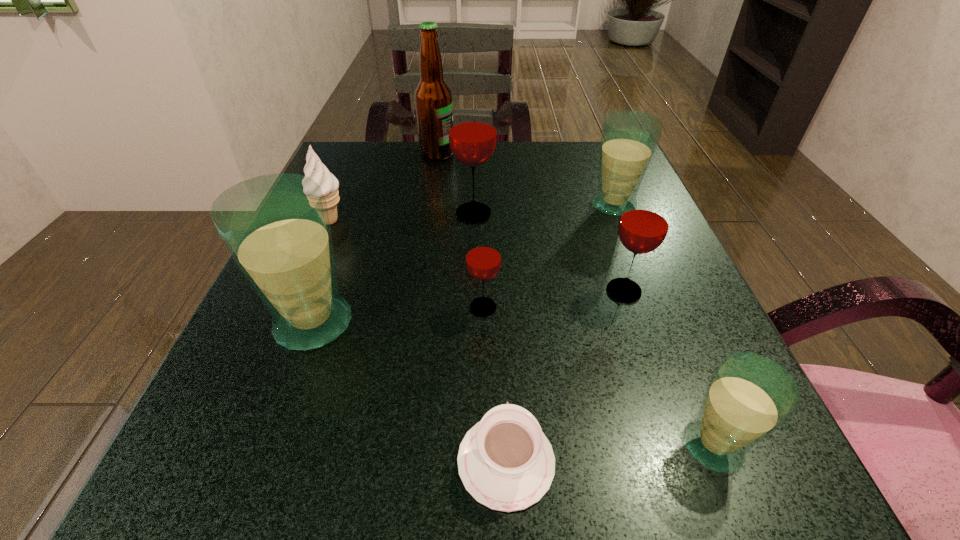
Where is `vacant region located 0.230m on the handle side of the teacup`? Image resolution: width=960 pixels, height=540 pixels. vacant region located 0.230m on the handle side of the teacup is located at coordinates 498,291.

Where is `blank area located 0.150m on the handle side of the teacup`? blank area located 0.150m on the handle side of the teacup is located at coordinates (500, 327).

Identify the location of free point located 0.220m on the handle side of the teacup. The height and width of the screenshot is (540, 960). coord(499,295).

Where is `beer bottle at the far edge`? beer bottle at the far edge is located at coordinates (433, 97).

Image resolution: width=960 pixels, height=540 pixels. I want to click on glass situated at the far edge, so click(629, 139).

Image resolution: width=960 pixels, height=540 pixels. Find the location of `glass at the near edge`. glass at the near edge is located at coordinates (749, 396).

Image resolution: width=960 pixels, height=540 pixels. I want to click on teacup positioned at the near edge, so click(505, 461).

Image resolution: width=960 pixels, height=540 pixels. I want to click on glass that is at the left edge, so click(276, 227).

At what (x,y) coordinates should I click in order to perform the action: click on icecream that is at the left edge. Please return your answer as a coordinate pair (x, y). The width and height of the screenshot is (960, 540). Looking at the image, I should click on (314, 168).

Identify the location of object that is at the far right corner. (629, 139).